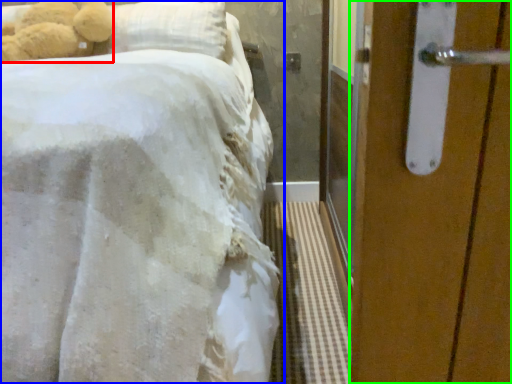
Question: Estimate the real-world distances between objects in this image. Which object is closer to teddy bear (highlighted by a red box), bed (highlighted by a blue box) or door (highlighted by a green box)?

Choices:
 (A) bed
 (B) door

Answer: (A)